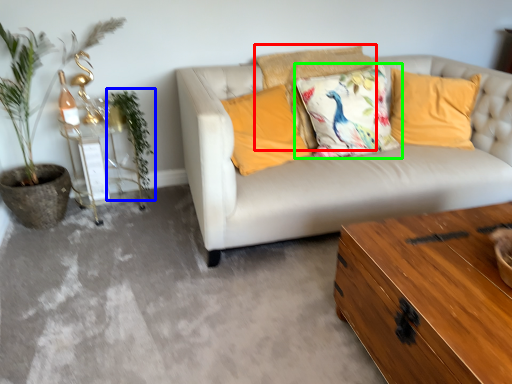
Question: Considering the real-world distances, which object is closest to pillow (highlighted by a red box)? plant (highlighted by a blue box) or pillow (highlighted by a green box).

Choices:
 (A) plant
 (B) pillow

Answer: (B)